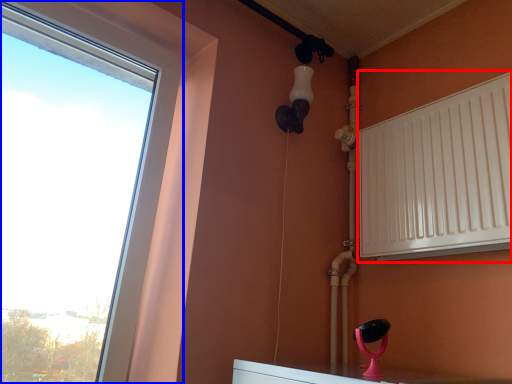
Question: Which object is closer to the camera taking this photo, radiator (highlighted by a red box) or window (highlighted by a blue box)?

Choices:
 (A) radiator
 (B) window

Answer: (B)